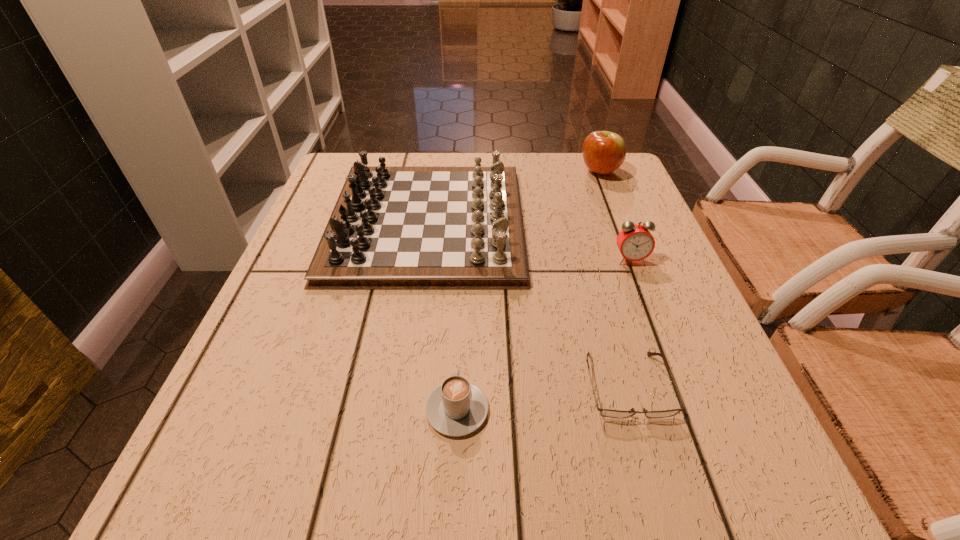
I want to click on vacant region at the far edge of the desktop, so click(x=556, y=156).

Locate an element on the screen. The image size is (960, 540). free space at the left edge of the desktop is located at coordinates (283, 338).

Locate an element on the screen. This screenshot has height=540, width=960. vacant area at the right edge is located at coordinates (630, 202).

Image resolution: width=960 pixels, height=540 pixels. In the image, there is a desktop. Find the location of `vacant space at the far left corner`. vacant space at the far left corner is located at coordinates (324, 181).

Where is `free region at the far right corner`? This screenshot has height=540, width=960. free region at the far right corner is located at coordinates (605, 180).

Identify the location of free location at the near right corner of the desktop. pos(714,508).

At what (x,y) coordinates should I click in order to perform the action: click on vacant point located between the fourth tallest object and the chessboard. Please return your answer as a coordinate pair (x, y). Looking at the image, I should click on (443, 316).

Find the location of a particular element. vacant area that lies between the third shortest object and the chessboard is located at coordinates (529, 241).

Find the location of a particular element. free spot between the third tallest object and the shortest object is located at coordinates (629, 322).

Locate an element on the screen. The width and height of the screenshot is (960, 540). vacant space that's between the apple and the cappuccino is located at coordinates pyautogui.click(x=529, y=291).